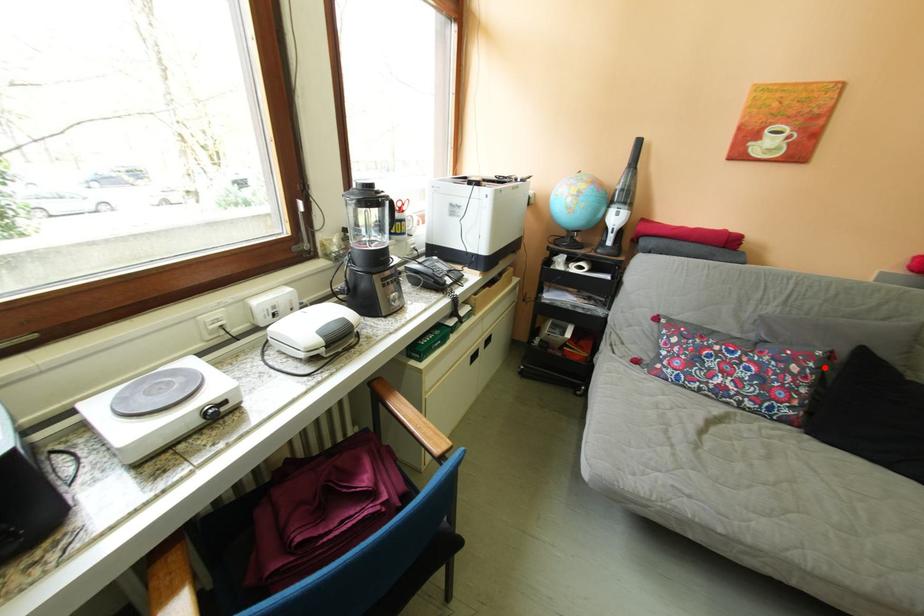
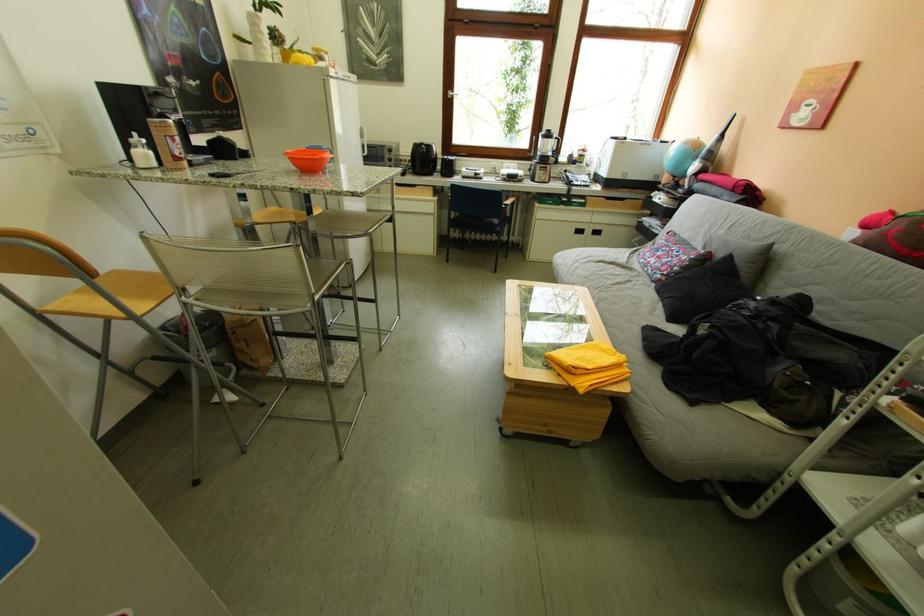
Question: A red point is marked in image1. In image2, is the corresponding 3D point closer to the camera or farther? Reply with the corresponding letter.

Choices:
 (A) The corresponding 3D point is closer.
 (B) The corresponding 3D point is farther.

Answer: (A)